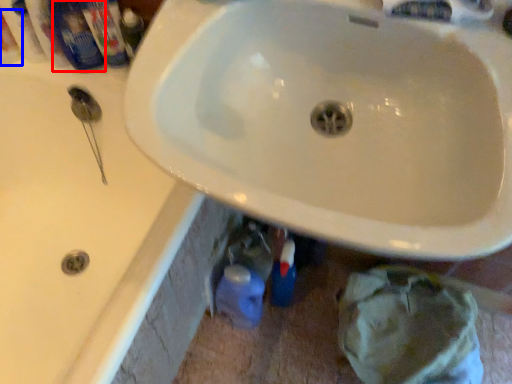
Question: Which of the following is the farthest to the observer, mouthwash (highlighted by a red box) or mouthwash (highlighted by a blue box)?

Choices:
 (A) mouthwash
 (B) mouthwash

Answer: (A)